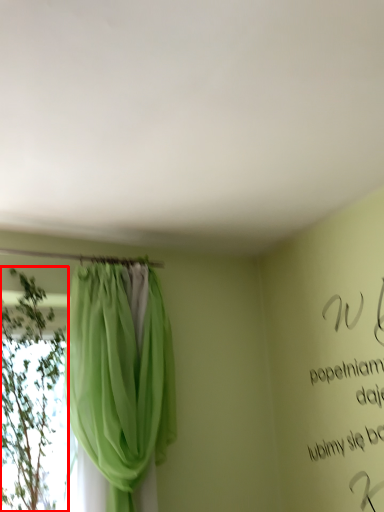
Question: In this image, where is plant (annotated by the red box) located relative to curtain?

Choices:
 (A) left
 (B) right

Answer: (A)